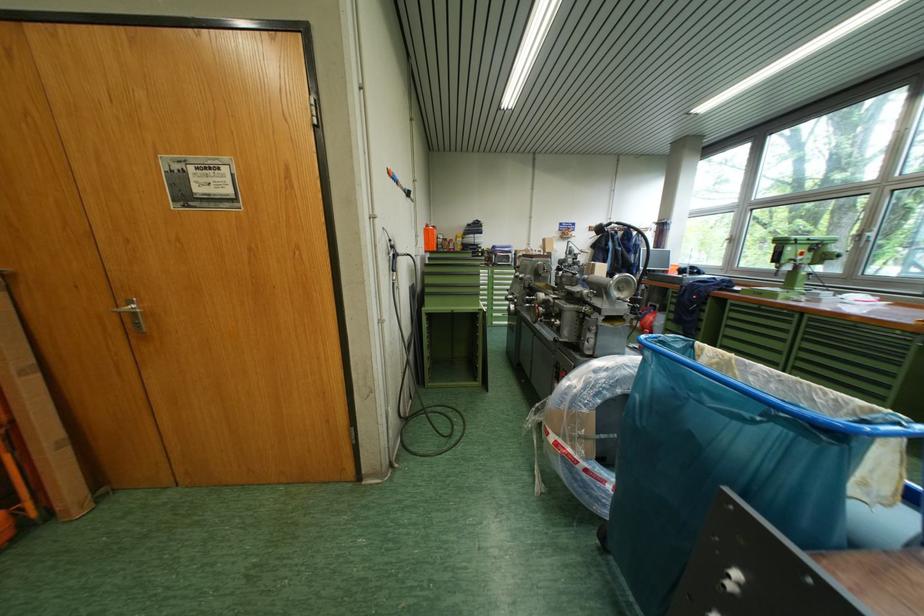
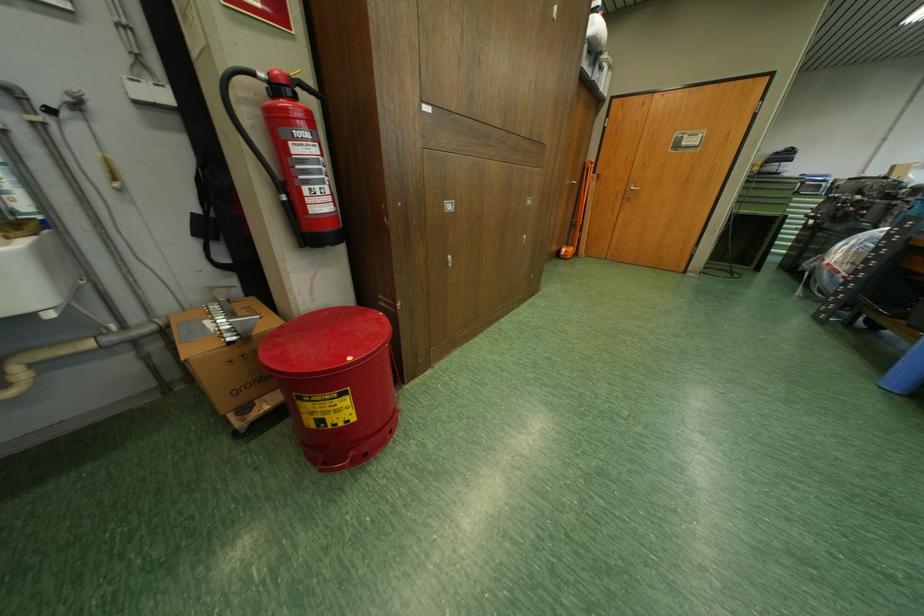
Locate, in the second image, the point that corresponds to point (131, 305) in the first image.

(638, 188)